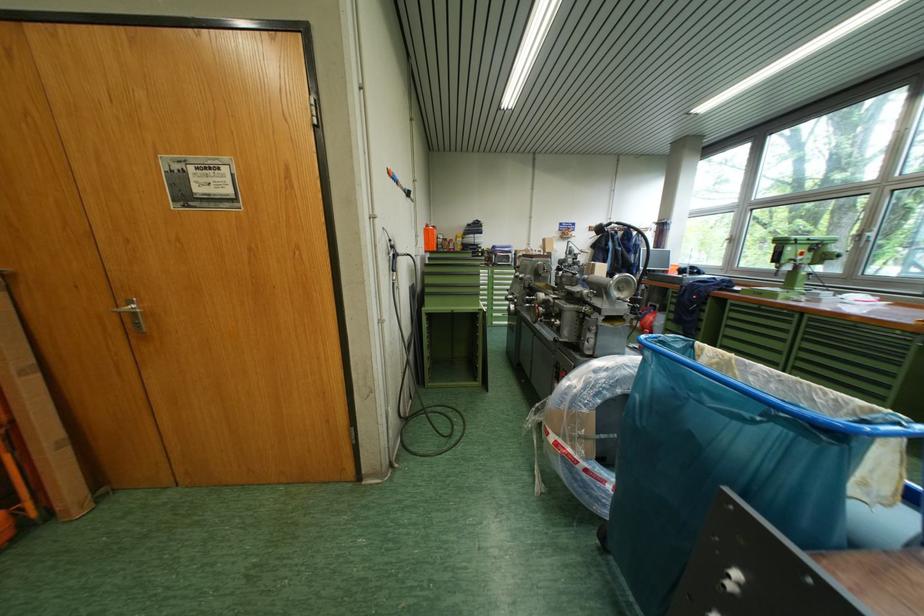
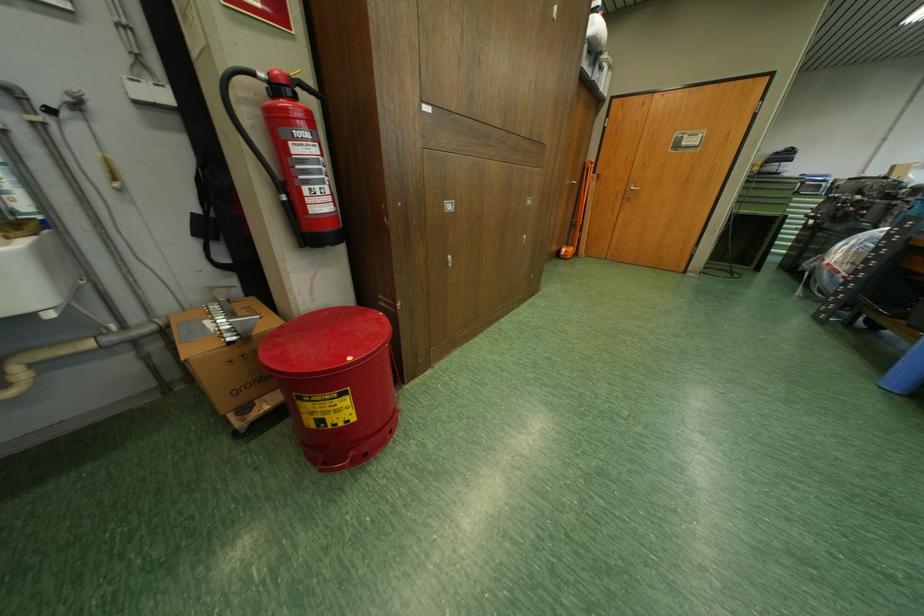
Locate, in the second image, the point that corresponds to point (131, 305) in the first image.

(638, 188)